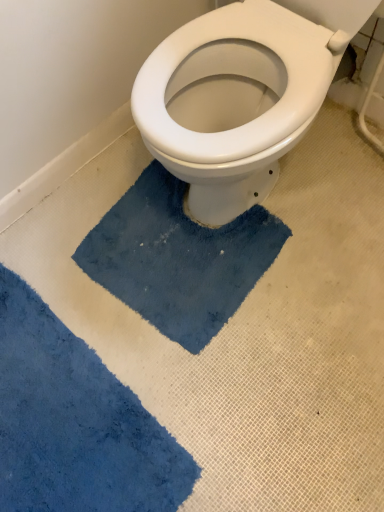
What are the coordinates of `free space that is to the left of blue plush bath mat at center, which is the second bath mat in bottom-to-top order` in the screenshot? It's located at (53, 293).